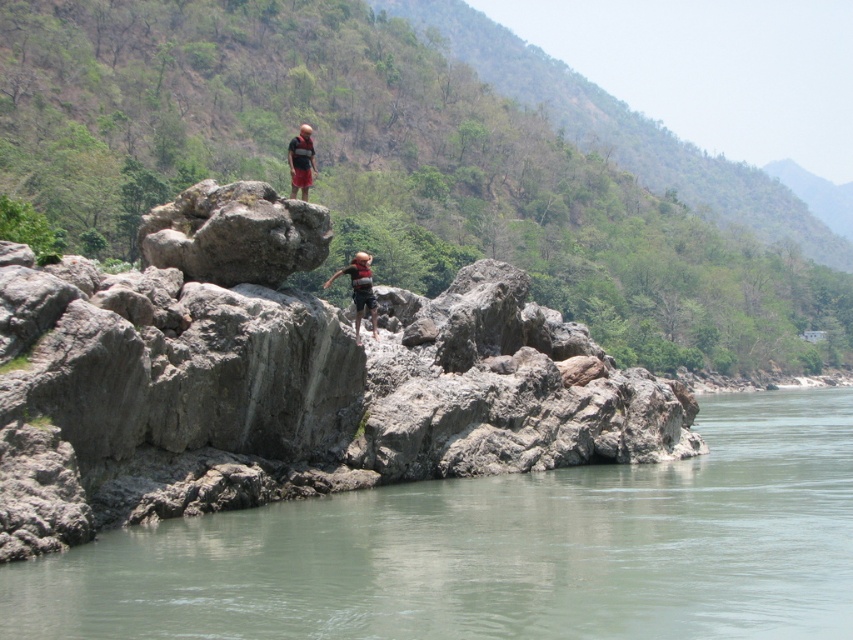
Question: Which object appears farthest from the camera in this image?

Choices:
 (A) matte black life vest at center
 (B) gray rock at lower left
 (C) gray rough rock at center
 (D) striped cotton shirt at center

Answer: (A)

Question: Which point is closer to the camera?

Choices:
 (A) (140, 515)
 (B) (292, 147)
 (C) (368, 307)

Answer: (A)

Question: Is gray rock at lower left bigger than striped cotton shirt at center?

Choices:
 (A) yes
 (B) no

Answer: (B)

Question: Is gray rock at lower left to the left of striped cotton shirt at center from the viewer's perspective?

Choices:
 (A) no
 (B) yes

Answer: (A)

Question: Estimate the real-world distances between objects in this image. Which object is closer to the gray rock at lower left?

Choices:
 (A) striped cotton shirt at center
 (B) gray rough rock at center
 (C) matte black life vest at center

Answer: (B)

Question: Does striped cotton shirt at center appear over matte black life vest at center?

Choices:
 (A) yes
 (B) no

Answer: (B)